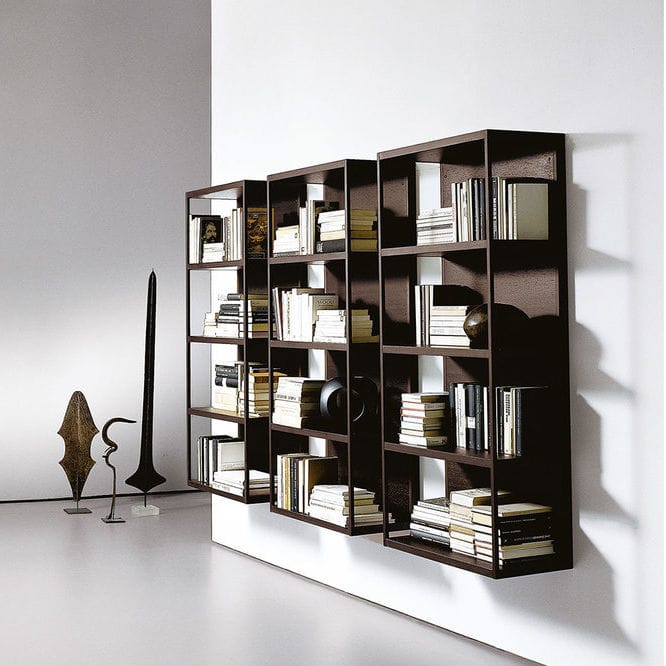
Find the location of a particular element. books on bookshelf one is located at coordinates (188, 238), (198, 252), (222, 252), (232, 244), (248, 234).